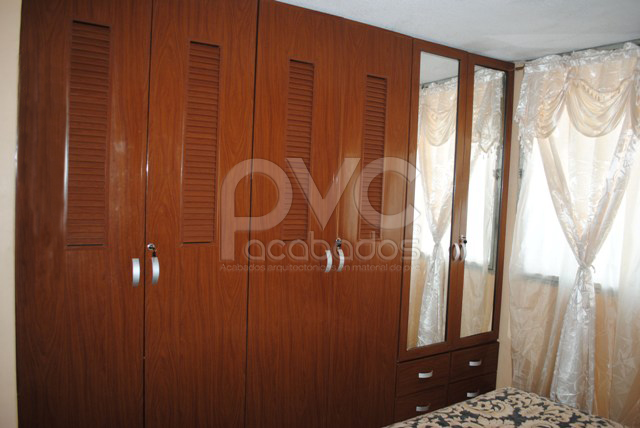
Where is `silver handles`? This screenshot has width=640, height=428. silver handles is located at coordinates (425, 374), (470, 363), (470, 393), (427, 409), (340, 262), (331, 262), (156, 265), (134, 271).